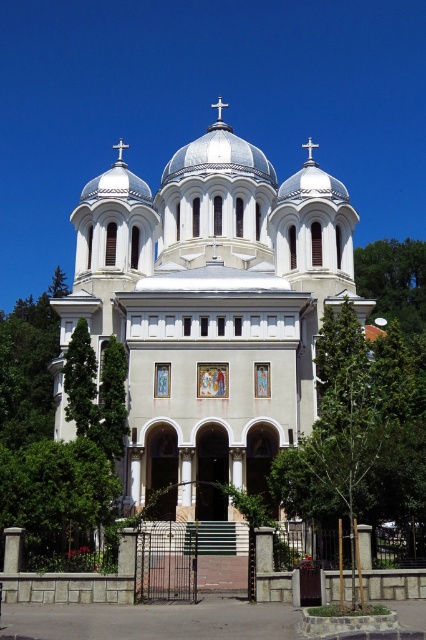
Question: Is white smooth church at center above green leafy tree at upper right?

Choices:
 (A) yes
 (B) no

Answer: (A)

Question: Which is nearer to the green leafy tree at lower left?

Choices:
 (A) green leafy tree at left
 (B) white glossy dome at center
 (C) white smooth church at center
 (D) green leafy tree at upper right

Answer: (A)

Question: Among these objects, which one is nearest to the camera?

Choices:
 (A) white smooth church at center
 (B) green leafy tree at lower left

Answer: (B)

Question: Can you confirm if green leafy tree at upper right is positioned to the right of white glossy dome at center?

Choices:
 (A) yes
 (B) no

Answer: (A)

Question: Does green leafy tree at lower left appear over green leafy tree at left?

Choices:
 (A) yes
 (B) no

Answer: (B)

Question: Among these points, which one is farthest from the camera?

Choices:
 (A) (97, 458)
 (B) (178, 163)
 (C) (83, 330)
 (D) (104, 328)

Answer: (B)